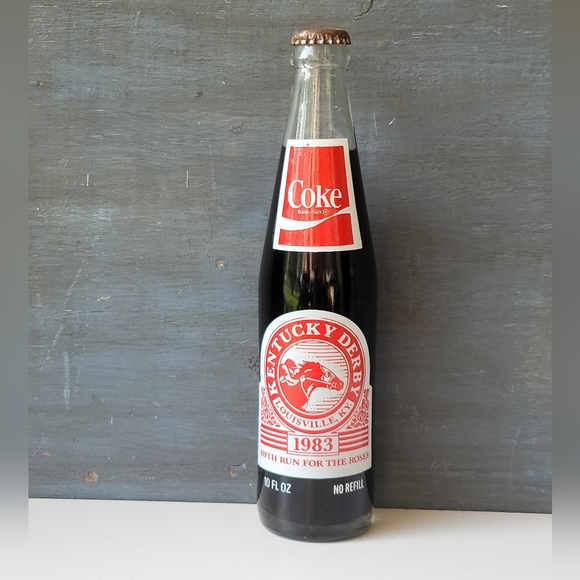
You are a GUI agent. You are given a task and a screenshot of the screen. Output one action in this format:
    pyautogui.click(x=<x>, y=<y>)
    Task: Click on the table
    The image size is (580, 580).
    Given the screenshot: What is the action you would take?
    pyautogui.click(x=501, y=557)